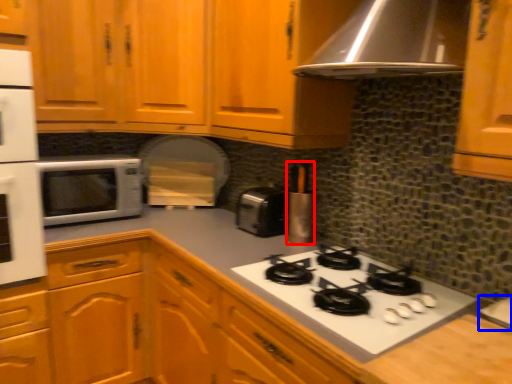
Question: Which point is further to the camera, kitchen appliance (highlighted by a red box) or sink (highlighted by a blue box)?

Choices:
 (A) kitchen appliance
 (B) sink

Answer: (A)